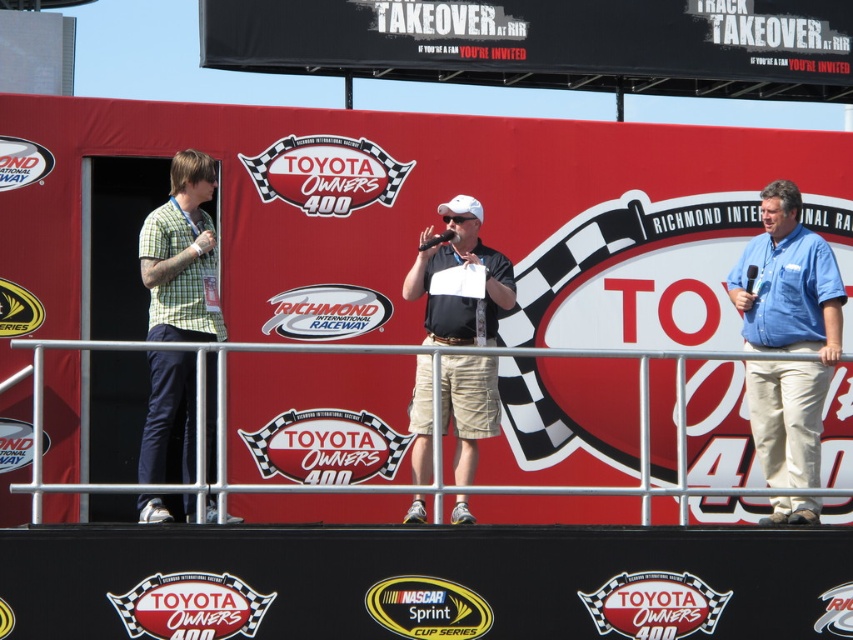
Does green checkered shirt at left appear over matte black shirt at center?

No.

Is point (199, 320) in front of point (456, 355)?

No, (199, 320) is behind (456, 355).

Where is `green checkered shirt at left`? This screenshot has height=640, width=853. green checkered shirt at left is located at coordinates (181, 253).

Who is higher up, blue shirt at right or green checkered shirt at left?

Positioned higher is green checkered shirt at left.

What do you see at coordinates (787, 336) in the screenshot? This screenshot has height=640, width=853. I see `blue shirt at right` at bounding box center [787, 336].

Who is more forward, (805,424) or (190,476)?

Point (190,476)

At what (x,y) coordinates should I click in order to perform the action: click on blue shirt at right. Please return your answer as a coordinate pair (x, y). The height and width of the screenshot is (640, 853). Looking at the image, I should click on (787, 336).

Who is shorter, green checkered shirt at left or metal at center?

green checkered shirt at left is shorter.

Does green checkered shirt at left have a greater width compared to metal at center?

In fact, green checkered shirt at left might be narrower than metal at center.

Which is in front, point (212, 280) or point (244, 342)?

Positioned in front is point (244, 342).

The height and width of the screenshot is (640, 853). I want to click on green checkered shirt at left, so click(181, 253).